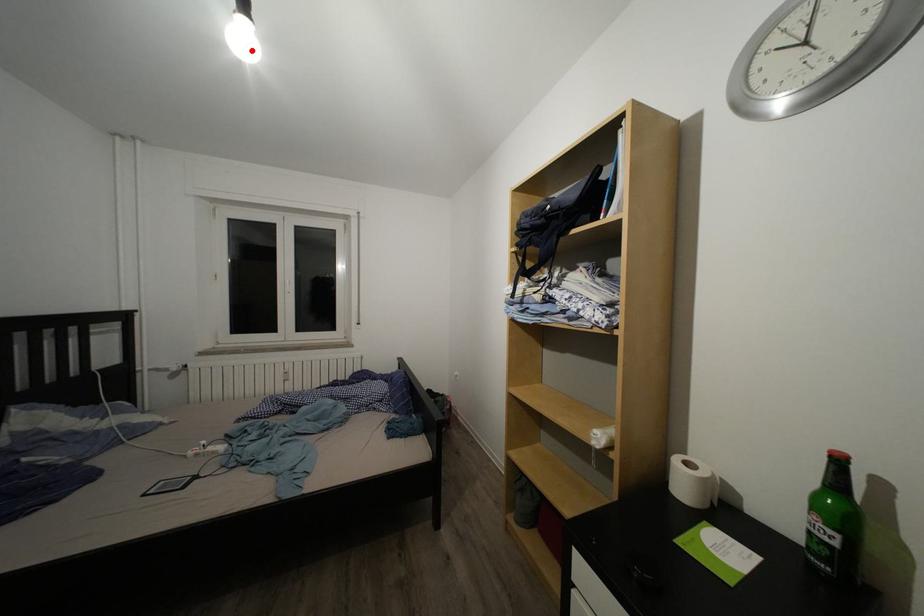
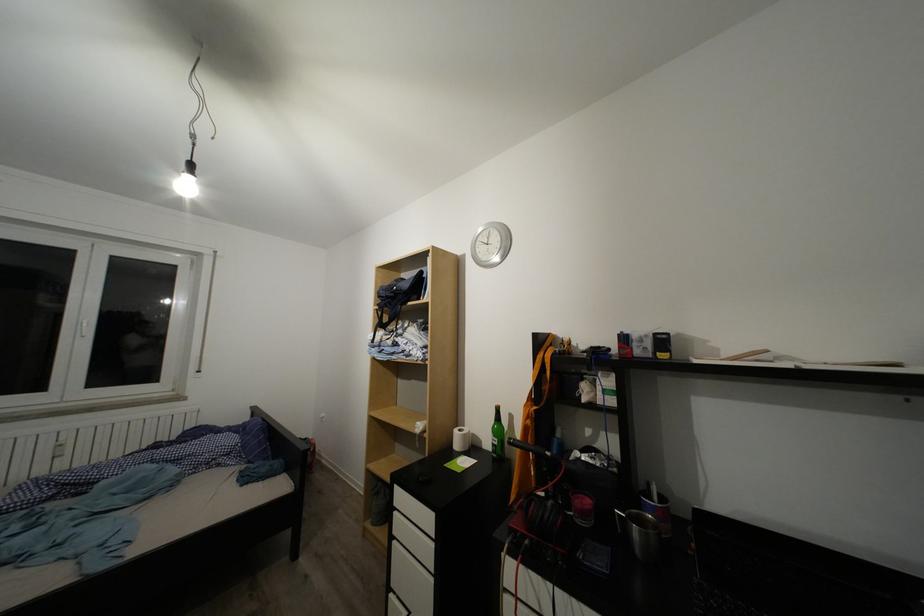
Question: I am providing you with two images of the same scene from different viewpoints. A red point is marked on the first image. Can you still see the location of the red point in image 2?

Choices:
 (A) Yes
 (B) No

Answer: (A)